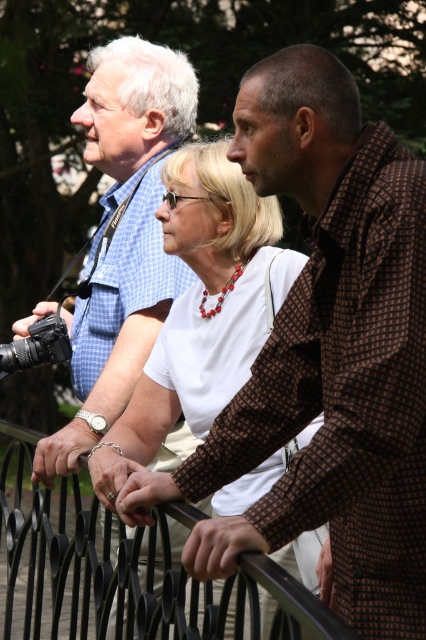
You are a photographer trying to capture a group photo of the three people in the scene. You notice the white matte shirt at center and the black plastic camera at left. Which object should you adjust to ensure both are visible in the frame?

The white matte shirt at center is much taller than the black plastic camera at left, so you should lower the camera angle slightly to include the entire height of the white matte shirt at center while still keeping the black plastic camera at left in view.